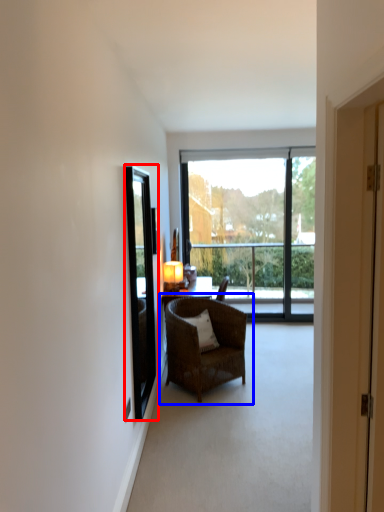
Question: Which of the following is the closest to the observer, window screen (highlighted by a red box) or chair (highlighted by a blue box)?

Choices:
 (A) window screen
 (B) chair

Answer: (A)